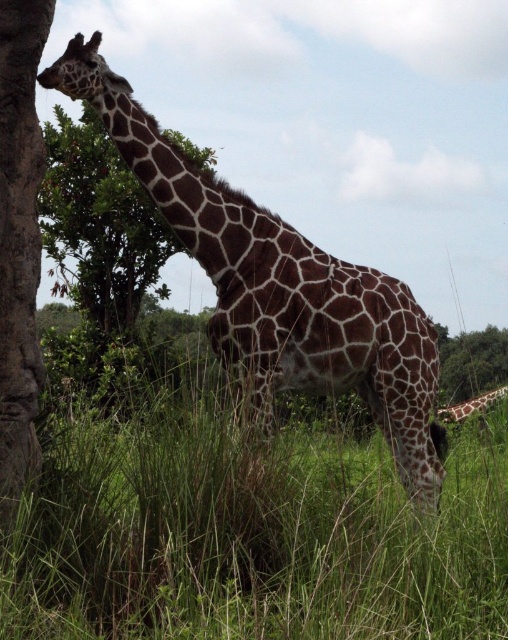
Question: From the image, what is the correct spatial relationship of brown spotted giraffe at center in relation to green leafy tree at upper left?

Choices:
 (A) below
 (B) above

Answer: (A)

Question: Considering the real-world distances, which object is closest to the brown rough tree trunk at left?

Choices:
 (A) brown spotted giraffe at right
 (B) brown spotted giraffe at center

Answer: (B)

Question: Is brown spotted giraffe at center positioned at the back of brown spotted giraffe at right?

Choices:
 (A) no
 (B) yes

Answer: (A)

Question: Which is nearer to the brown rough tree trunk at left?

Choices:
 (A) brown spotted giraffe at right
 (B) brown spotted giraffe at center
 (C) green leafy tree at upper left

Answer: (B)

Question: Which point appears farthest from the camera in this image?

Choices:
 (A) (452, 417)
 (B) (31, 397)

Answer: (A)

Question: Does green leafy tree at upper left appear on the left side of brown rough tree trunk at left?

Choices:
 (A) yes
 (B) no

Answer: (A)